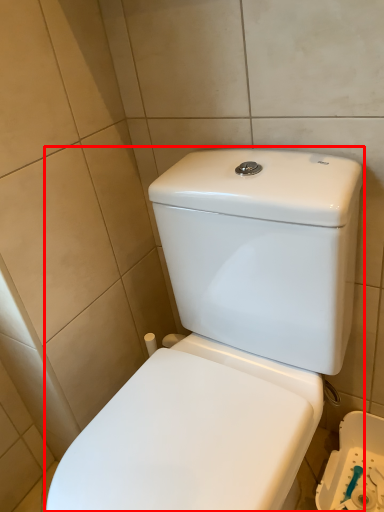
Question: From the image's perspective, what is the correct spatial relationship of toilet (annotated by the red box) in relation to porcelain?

Choices:
 (A) below
 (B) above

Answer: (B)